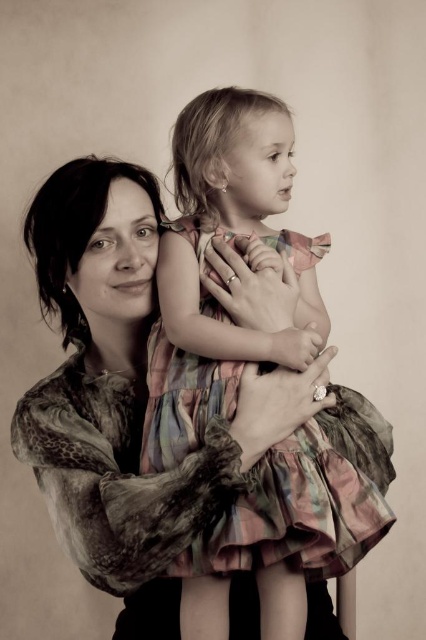
Question: Which point is closer to the camera?

Choices:
 (A) (155, 563)
 (B) (333, 538)

Answer: (B)

Question: Can you confirm if plaid fabric dress at center is bigger than printed silk blouse at center?

Choices:
 (A) yes
 (B) no

Answer: (B)

Question: Is plaid fabric dress at center closer to the viewer compared to printed silk blouse at center?

Choices:
 (A) no
 (B) yes

Answer: (B)

Question: Among these objects, which one is farthest from the camera?

Choices:
 (A) plaid fabric dress at center
 (B) printed silk blouse at center

Answer: (B)

Question: Is plaid fabric dress at center further to the viewer compared to printed silk blouse at center?

Choices:
 (A) yes
 (B) no

Answer: (B)

Question: Which object appears farthest from the camera in this image?

Choices:
 (A) printed silk blouse at center
 (B) plaid fabric dress at center

Answer: (A)